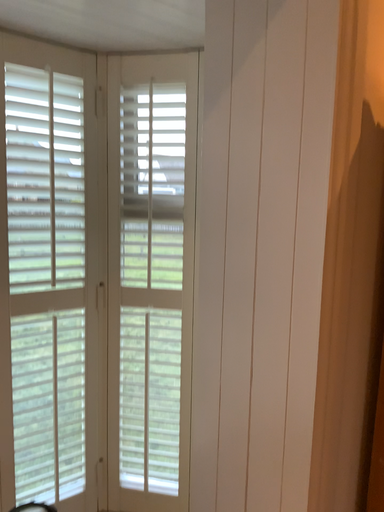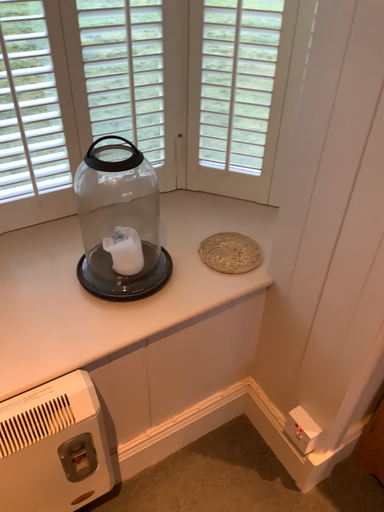
Question: Which way did the camera rotate in the video?

Choices:
 (A) rotated downward
 (B) rotated upward

Answer: (A)